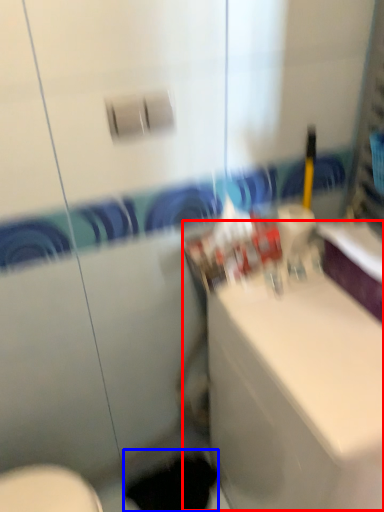
Question: Among these objects, which one is nearest to the camera, counter top (highlighted by a red box) or hole (highlighted by a blue box)?

Choices:
 (A) counter top
 (B) hole

Answer: (A)